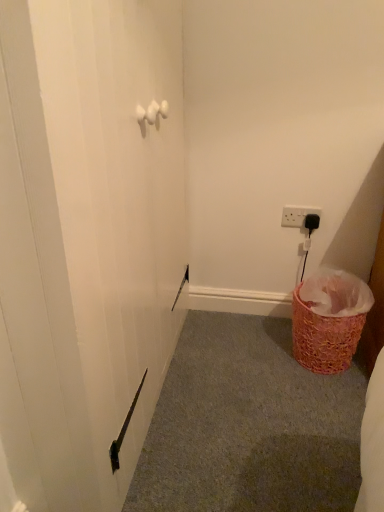
Question: Is white plastic electric outlet at upper right thinner than ruffled pink basket at lower right?

Choices:
 (A) no
 (B) yes

Answer: (B)

Question: Are white plastic electric outlet at upper right and ruffled pink basket at lower right far apart?

Choices:
 (A) no
 (B) yes

Answer: (A)

Question: Could you tell me if white plastic electric outlet at upper right is turned towards ruffled pink basket at lower right?

Choices:
 (A) yes
 (B) no

Answer: (B)

Question: Can you confirm if white plastic electric outlet at upper right is wider than ruffled pink basket at lower right?

Choices:
 (A) no
 (B) yes

Answer: (A)

Question: Are white plastic electric outlet at upper right and ruffled pink basket at lower right making contact?

Choices:
 (A) no
 (B) yes

Answer: (A)

Question: Do you think ruffled pink basket at lower right is within white plastic electric outlet at upper right, or outside of it?

Choices:
 (A) inside
 (B) outside

Answer: (B)

Question: Considering the positions of ruffled pink basket at lower right and white plastic electric outlet at upper right in the image, is ruffled pink basket at lower right bigger or smaller than white plastic electric outlet at upper right?

Choices:
 (A) small
 (B) big

Answer: (B)

Question: Is ruffled pink basket at lower right in front of or behind white plastic electric outlet at upper right in the image?

Choices:
 (A) front
 (B) behind

Answer: (A)

Question: Is point (304, 316) closer or farther from the camera than point (288, 207)?

Choices:
 (A) farther
 (B) closer

Answer: (B)

Question: Considering their positions, is pink woven basket at lower right located in front of or behind white plastic electric outlet at upper right?

Choices:
 (A) behind
 (B) front

Answer: (B)

Question: Considering the positions of pink woven basket at lower right and white plastic electric outlet at upper right in the image, is pink woven basket at lower right taller or shorter than white plastic electric outlet at upper right?

Choices:
 (A) tall
 (B) short

Answer: (B)

Question: From the image's perspective, is pink woven basket at lower right located above or below white plastic electric outlet at upper right?

Choices:
 (A) above
 (B) below

Answer: (B)

Question: Visually, is pink woven basket at lower right positioned to the left or to the right of white plastic electric outlet at upper right?

Choices:
 (A) right
 (B) left

Answer: (B)

Question: In the image, is white plastic electric outlet at upper right on the left side or the right side of ruffled pink basket at lower right?

Choices:
 (A) left
 (B) right

Answer: (A)

Question: Considering the positions of white plastic electric outlet at upper right and ruffled pink basket at lower right in the image, is white plastic electric outlet at upper right bigger or smaller than ruffled pink basket at lower right?

Choices:
 (A) big
 (B) small

Answer: (B)